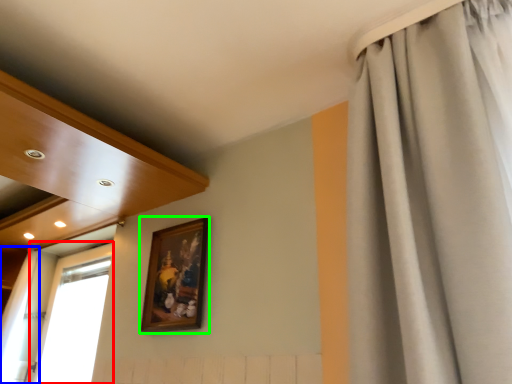
Question: Which object is the farthest from window (highlighted by a red box)? Choose among these: curtain (highlighted by a blue box) or picture frame (highlighted by a green box).

Choices:
 (A) curtain
 (B) picture frame

Answer: (B)